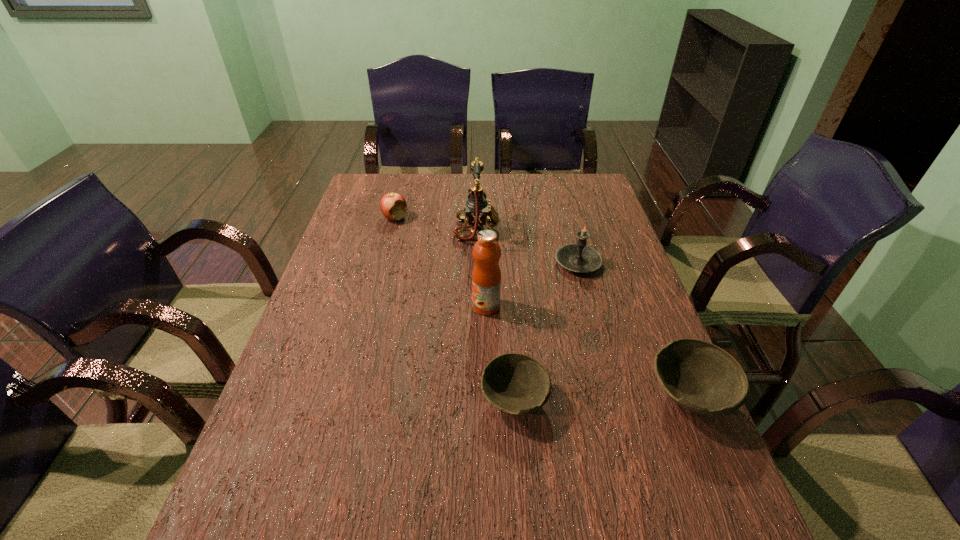
Find the location of a particular element. The image size is (960, 540). the left bowl is located at coordinates (515, 383).

Find the location of a particular element. This screenshot has height=540, width=960. the shorter bowl is located at coordinates (515, 383).

The image size is (960, 540). I want to click on the rightmost object, so click(x=700, y=377).

Locate an element on the screen. the taller bowl is located at coordinates (700, 377).

Find the location of a particular element. the leftmost object is located at coordinates (393, 205).

Locate an element on the screen. the fourth shortest object is located at coordinates (579, 257).

Where is `the fifth object from left to right`? The image size is (960, 540). the fifth object from left to right is located at coordinates (579, 257).

This screenshot has width=960, height=540. In order to click on telephone in this screenshot , I will do `click(477, 211)`.

Locate an element on the screen. The width and height of the screenshot is (960, 540). fruit juice is located at coordinates (486, 276).

You are a GUI agent. You are given a task and a screenshot of the screen. Output one action in this format:
    pyautogui.click(x=<x>, y=<y>)
    Task: Click on the free space located 0.070m on the back of the shortest object
    The height and width of the screenshot is (540, 960).
    Given the screenshot: What is the action you would take?
    coord(511,348)